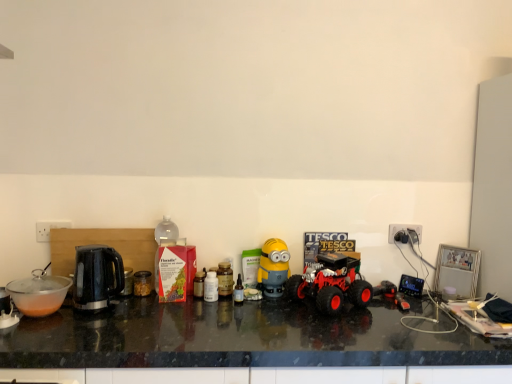
Where is `vacant area that is situated to the right of translucent plastic bottle at center, arranged as the 3th bottle when viewed from the left`? This screenshot has width=512, height=384. vacant area that is situated to the right of translucent plastic bottle at center, arranged as the 3th bottle when viewed from the left is located at coordinates (287, 305).